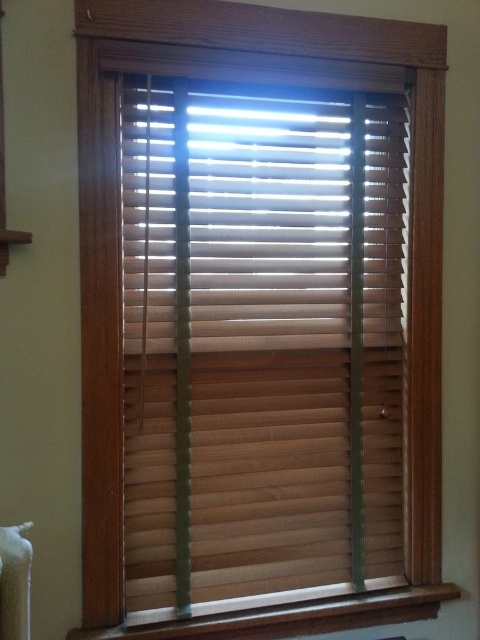
Question: Can you confirm if wooden blinds at center is wider than wooden at lower center?

Choices:
 (A) no
 (B) yes

Answer: (A)

Question: Can you confirm if wooden blinds at center is positioned above wooden at lower center?

Choices:
 (A) no
 (B) yes

Answer: (B)

Question: Can you confirm if wooden blinds at center is smaller than wooden at lower center?

Choices:
 (A) no
 (B) yes

Answer: (A)